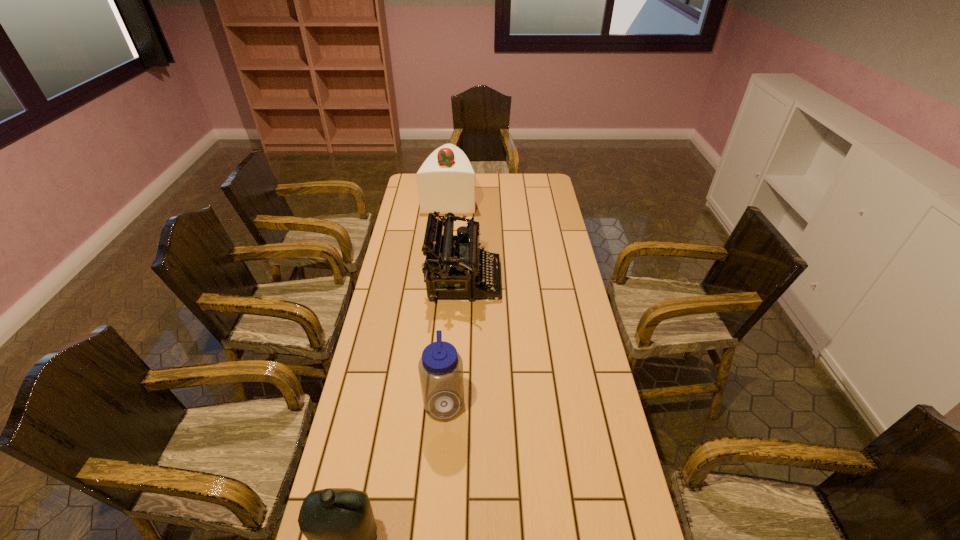
In the image, there is a desktop. Identify the location of vacant space at the left edge. This screenshot has height=540, width=960. (410, 255).

Identify the location of blank space at the right edge of the desktop. (588, 422).

Find the location of `vacant space at the far left corner of the desktop`. vacant space at the far left corner of the desktop is located at coordinates [409, 179].

I want to click on free space between the second nearest object and the farthest object, so click(x=447, y=299).

This screenshot has width=960, height=540. I want to click on vacant space that is in between the second farthest object and the second nearest object, so click(x=454, y=340).

This screenshot has width=960, height=540. I want to click on vacant point located between the second farthest object and the water bottle, so click(454, 340).

The image size is (960, 540). I want to click on unoccupied area between the tallest object and the water bottle, so click(447, 299).

Locate an element on the screen. Image resolution: width=960 pixels, height=540 pixels. unoccupied position between the second farthest object and the second nearest object is located at coordinates (454, 340).

You are a GUI agent. You are given a task and a screenshot of the screen. Output one action in this format:
    pyautogui.click(x=<x>, y=<y>)
    Task: Click on the closest object relative to the typewriter
    The width and height of the screenshot is (960, 540).
    Given the screenshot: What is the action you would take?
    pyautogui.click(x=446, y=180)

Where is `the third closest object to the third farthest object`? the third closest object to the third farthest object is located at coordinates (446, 180).